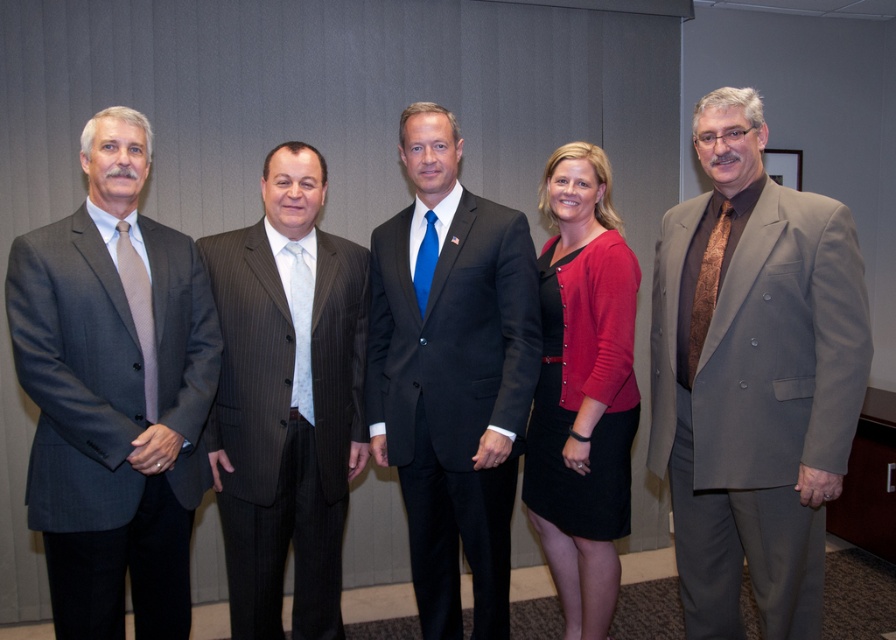
Between pinstriped suit at center and matte red cardigan at center, which one has more height?

matte red cardigan at center

Does point (227, 525) come behind point (593, 625)?

That is False.

Identify the location of pinstriped suit at center. Image resolution: width=896 pixels, height=640 pixels. (286, 401).

Which of these two, matte gray suit at left or matte red cardigan at center, stands taller?

matte red cardigan at center

Is matte gray suit at left positioned at the back of matte red cardigan at center?

No, it is in front of matte red cardigan at center.

The width and height of the screenshot is (896, 640). I want to click on matte gray suit at left, so click(114, 394).

The width and height of the screenshot is (896, 640). I want to click on matte gray suit at right, so click(x=754, y=378).

Between matte gray suit at right and pinstriped suit at center, which one appears on the right side from the viewer's perspective?

matte gray suit at right is more to the right.

Which is behind, point (816, 508) or point (296, 412)?

The point (296, 412) is behind.

Locate an element on the screen. The height and width of the screenshot is (640, 896). matte gray suit at right is located at coordinates (754, 378).